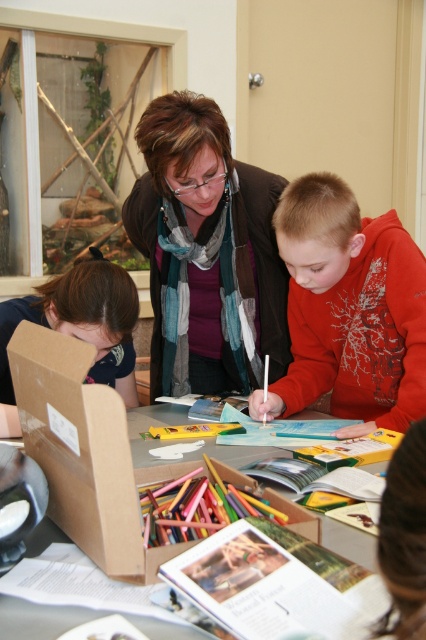
Who is more forward, (x=187, y=250) or (x=304, y=332)?

Point (x=304, y=332) is more forward.

What do you see at coordinates (206, 252) in the screenshot? This screenshot has width=426, height=640. I see `matte brown jacket at center` at bounding box center [206, 252].

What are the coordinates of `matte brown jacket at center` in the screenshot? It's located at (206, 252).

Does point (232, 499) come in front of point (296, 515)?

No, it is behind (296, 515).

Which is behind, point (176, 483) or point (356, 536)?

Point (176, 483)

This screenshot has height=640, width=426. Identify the location of multicolored wax crayons at center. (196, 506).

Is matte orange hoodie at center closer to camera compared to brown cardboard box at center?

No.

Between matte orange hoodie at center and brown cardboard box at center, which one has less height?

Standing shorter between the two is brown cardboard box at center.

Locate an element on the screen. This screenshot has height=640, width=426. matte orange hoodie at center is located at coordinates (348, 308).